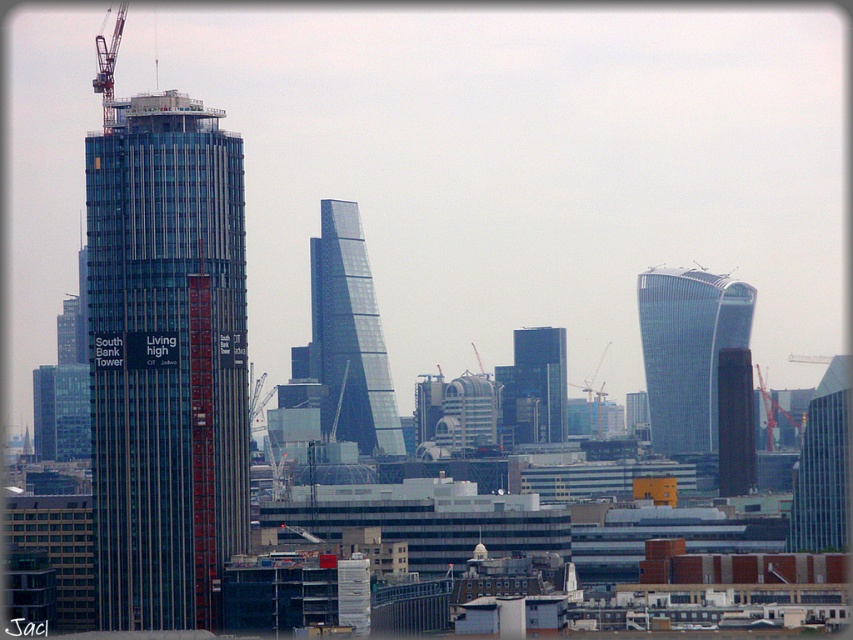
Measure the distance between matte glass skyscraper at center and camera.

They are 659.62 meters apart.

Between point (723, 480) and point (595, 406), which one is positioned behind?

Point (723, 480)

Does point (727, 404) come closer to viewer compared to point (596, 369)?

No, it is behind (596, 369).

At what (x,y) coordinates should I click in order to perform the action: click on matte glass skyscraper at center. Please return your answer as a coordinate pair (x, y). The height and width of the screenshot is (640, 853). Looking at the image, I should click on (735, 422).

Does point (675, 445) lie in front of point (738, 468)?

Yes, point (675, 445) is in front of point (738, 468).

Between glassy steel skyscraper at right and matte glass skyscraper at center, which one is positioned higher?

glassy steel skyscraper at right is higher up.

Who is more forward, (x=699, y=323) or (x=737, y=360)?

Point (x=699, y=323) is more forward.

Find the location of a particular element. glassy steel skyscraper at right is located at coordinates (688, 349).

Is point (689, 404) positioned after point (595, 410)?

Yes, it is.

In the scene shown: Does glassy steel skyscraper at right appear on the left side of metallic construction crane at center?

Incorrect, glassy steel skyscraper at right is not on the left side of metallic construction crane at center.

At what (x,y) coordinates should I click in order to perform the action: click on glassy steel skyscraper at right. Please return your answer as a coordinate pair (x, y). The width and height of the screenshot is (853, 640). Looking at the image, I should click on (688, 349).

Where is `glassy steel skyscraper at right`? glassy steel skyscraper at right is located at coordinates (688, 349).